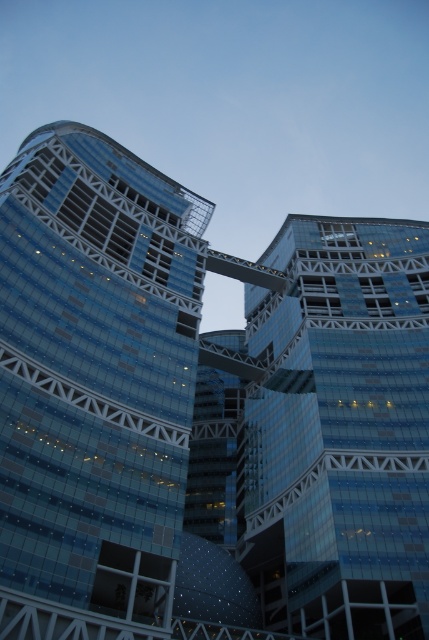
Is transparent glass building at left to the left of transparent glass building at center from the viewer's perspective?

Correct, you'll find transparent glass building at left to the left of transparent glass building at center.

Does transparent glass building at left have a greater width compared to transparent glass building at center?

No, transparent glass building at left is not wider than transparent glass building at center.

Which is in front, point (66, 580) or point (416, 452)?

Point (66, 580) is more forward.

Locate an element on the screen. transparent glass building at left is located at coordinates (93, 385).